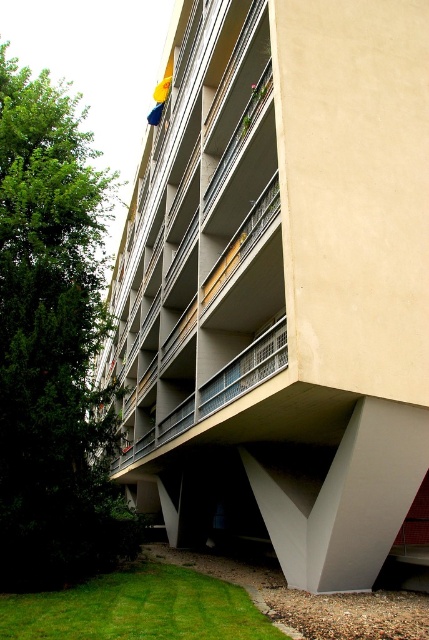
Can you confirm if green leafy tree at left is thinner than green grass at lower left?

Incorrect, green leafy tree at left's width is not less than green grass at lower left's.

Who is positioned more to the right, green leafy tree at left or green grass at lower left?

Positioned to the right is green grass at lower left.

The height and width of the screenshot is (640, 429). Find the location of `green leafy tree at left`. green leafy tree at left is located at coordinates (54, 346).